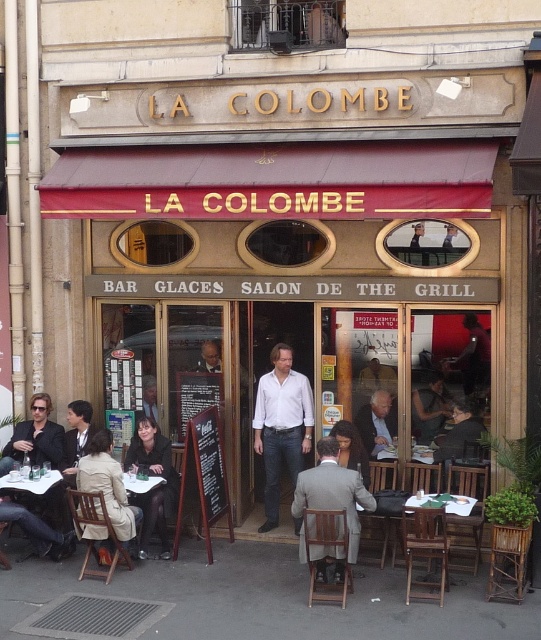
Question: Which point is farther to the camera?

Choices:
 (A) white glossy table at lower left
 (B) wooden table at center

Answer: (A)

Question: Which object is farther from the camera taking this photo?

Choices:
 (A) dark brown leather jacket at lower left
 (B) gray wool suit at center
 (C) light brown leather jacket at center

Answer: (C)

Question: Does gray wool suit at center appear on the right side of smooth beige shirt at center?

Choices:
 (A) yes
 (B) no

Answer: (A)

Question: Can you confirm if gray wool suit at center is positioned below dark brown leather jacket at lower left?

Choices:
 (A) no
 (B) yes

Answer: (B)

Question: Based on their relative distances, which object is farther from the white matte shirt at center?

Choices:
 (A) light beige coat at lower left
 (B) light brown leather jacket at center
 (C) smooth beige shirt at center

Answer: (A)

Question: Does light beige coat at lower left appear on the left side of light brown leather jacket at center?

Choices:
 (A) no
 (B) yes

Answer: (B)